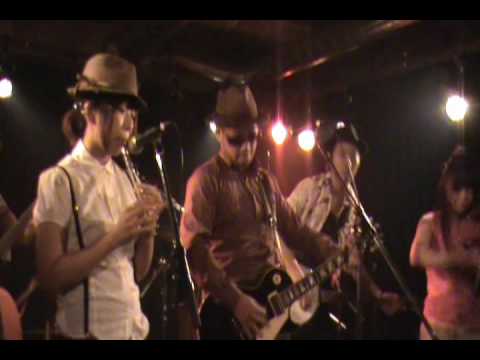
The width and height of the screenshot is (480, 360). In order to click on 5 lights in this screenshot , I will do `click(458, 104)`, `click(309, 142)`, `click(278, 132)`, `click(212, 128)`, `click(3, 90)`.